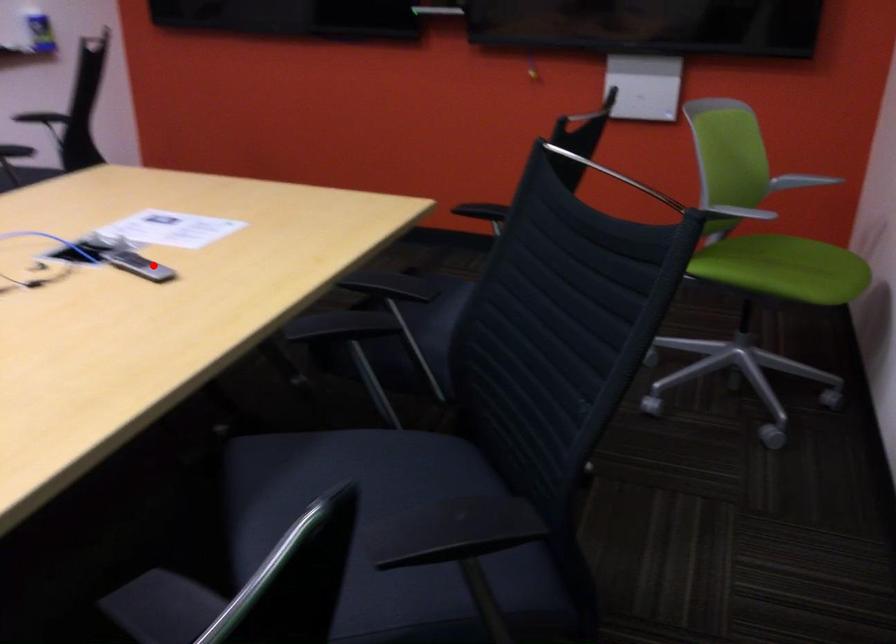
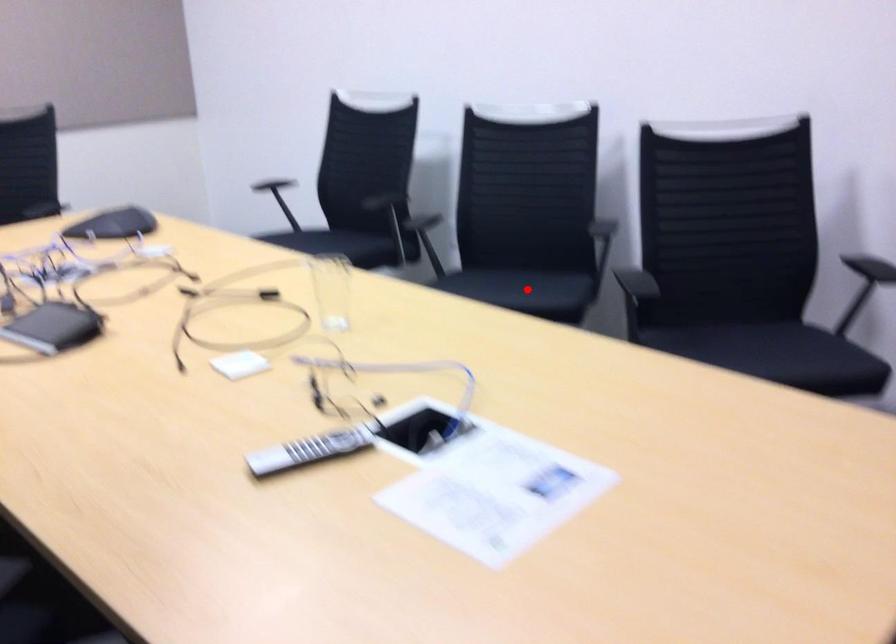
I am providing you with two images of the same scene from different viewpoints. A red point is marked on the first image and another point is marked on the second image. Are the points marked in image1 and image2 representing the same 3D position?

No